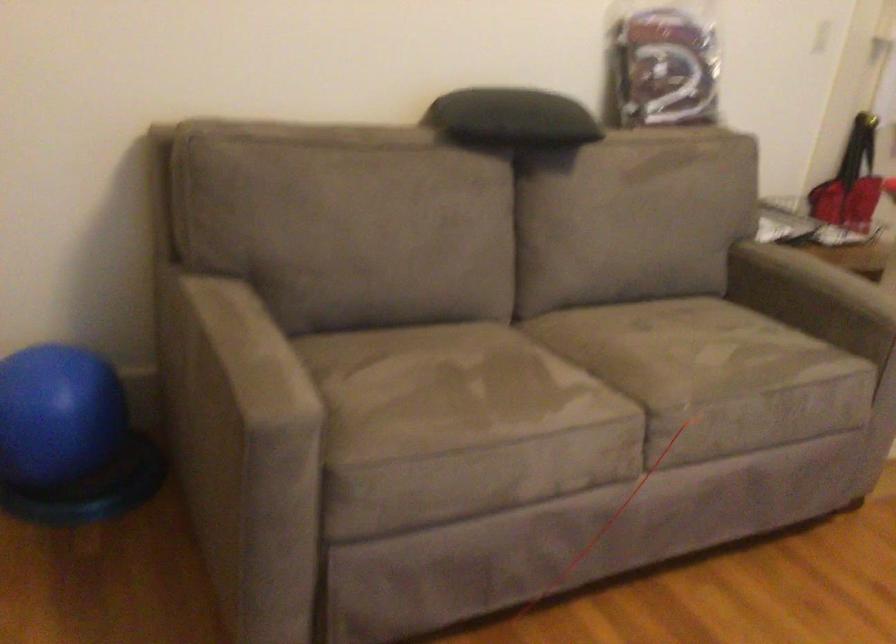
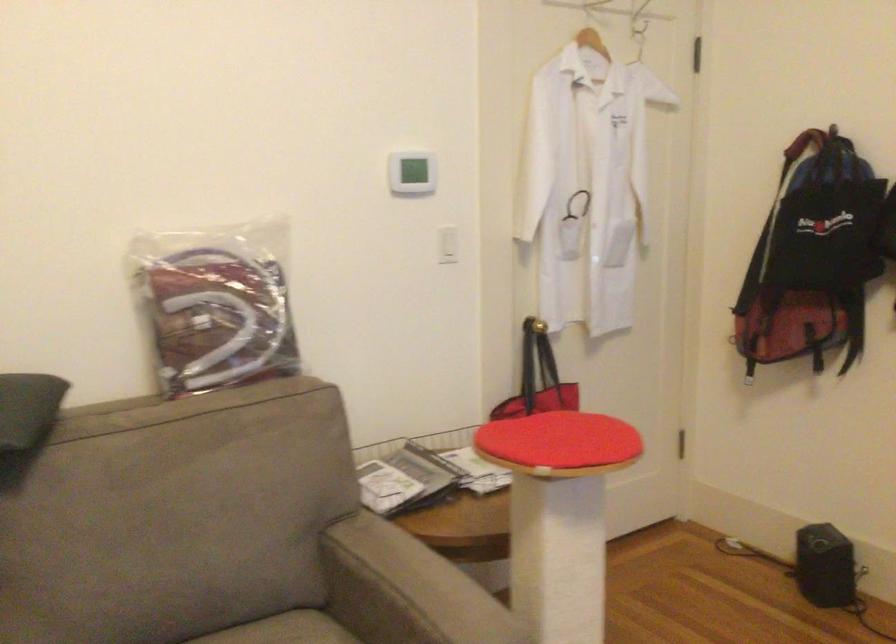
In a continuous first-person perspective shot, in which direction is the camera moving?

The cameraman moved toward right, forward.